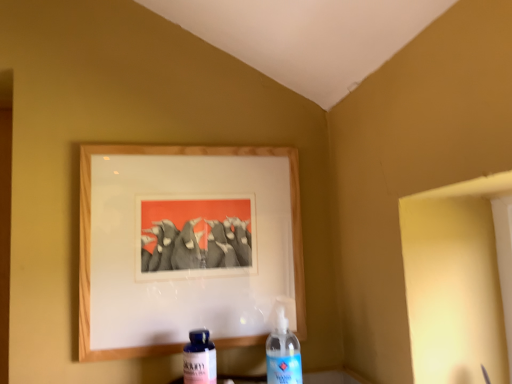
This screenshot has height=384, width=512. Describe the element at coordinates (183, 155) in the screenshot. I see `wooden picture frame at upper center` at that location.

What do you see at coordinates (283, 352) in the screenshot? I see `transparent plastic bottle at center, which is counted as the 1th bottle, starting from the right` at bounding box center [283, 352].

Find the location of `blue glass bottle at lower center, which ranks as the 2th bottle in right-to-left order`. blue glass bottle at lower center, which ranks as the 2th bottle in right-to-left order is located at coordinates (199, 358).

Could you measure the distance between blue glass bottle at lower center, which ranks as the 2th bottle in right-to-left order, and wooden picture frame at upper center?

blue glass bottle at lower center, which ranks as the 2th bottle in right-to-left order, and wooden picture frame at upper center are 24.17 centimeters apart.

Is blue glass bottle at lower center, marked as the first bottle in a left-to-right arrangement, in front of wooden picture frame at upper center?

Yes, it is in front of wooden picture frame at upper center.

From a real-world perspective, is blue glass bottle at lower center, which ranks as the 2th bottle in right-to-left order, positioned above or below wooden picture frame at upper center?

In terms of real-world spatial position, blue glass bottle at lower center, which ranks as the 2th bottle in right-to-left order, is below wooden picture frame at upper center.

Does point (215, 349) come farther from viewer compared to point (226, 345)?

No, (215, 349) is closer to viewer.

In order to click on the 1st bottle directly beneath the wooden picture frame at upper center (from a real-world perspective) in this screenshot , I will do `click(283, 352)`.

Which of these two, transparent plastic bottle at center, which ranks as the 2th bottle in left-to-right order, or wooden picture frame at upper center, is bigger?

With larger size is wooden picture frame at upper center.

From the image's perspective, which object appears higher, transparent plastic bottle at center, which is counted as the 1th bottle, starting from the right, or wooden picture frame at upper center?

wooden picture frame at upper center.

Does transparent plastic bottle at center, which is counted as the 1th bottle, starting from the right, lie behind wooden picture frame at upper center?

No, transparent plastic bottle at center, which is counted as the 1th bottle, starting from the right, is closer to the camera.

From the picture: From the image's perspective, between wooden picture frame at upper center and transparent plastic bottle at center, which is counted as the 1th bottle, starting from the right, who is located below?

From the image's view, transparent plastic bottle at center, which is counted as the 1th bottle, starting from the right, is below.

Considering the relative positions of wooden picture frame at upper center and transparent plastic bottle at center, which ranks as the 2th bottle in left-to-right order, in the image provided, is wooden picture frame at upper center to the left or to the right of transparent plastic bottle at center, which ranks as the 2th bottle in left-to-right order,?

wooden picture frame at upper center is to the left of transparent plastic bottle at center, which ranks as the 2th bottle in left-to-right order.

How different are the orientations of wooden picture frame at upper center and transparent plastic bottle at center, which is counted as the 1th bottle, starting from the right, in degrees?

The angular difference between wooden picture frame at upper center and transparent plastic bottle at center, which is counted as the 1th bottle, starting from the right, is 4.75 degrees.

Is wooden picture frame at upper center outside of transparent plastic bottle at center, which ranks as the 2th bottle in left-to-right order?

Indeed, wooden picture frame at upper center is completely outside transparent plastic bottle at center, which ranks as the 2th bottle in left-to-right order.

From the image's perspective, is blue glass bottle at lower center, marked as the first bottle in a left-to-right arrangement, located above or below transparent plastic bottle at center, which ranks as the 2th bottle in left-to-right order?

Clearly, from the image's perspective, blue glass bottle at lower center, marked as the first bottle in a left-to-right arrangement, is below transparent plastic bottle at center, which ranks as the 2th bottle in left-to-right order.

Is blue glass bottle at lower center, which ranks as the 2th bottle in right-to-left order, turned away from transparent plastic bottle at center, which is counted as the 1th bottle, starting from the right?

blue glass bottle at lower center, which ranks as the 2th bottle in right-to-left order, is not turned away from transparent plastic bottle at center, which is counted as the 1th bottle, starting from the right.

In the image, is blue glass bottle at lower center, marked as the first bottle in a left-to-right arrangement, on the left side or the right side of transparent plastic bottle at center, which is counted as the 1th bottle, starting from the right?

Based on their positions, blue glass bottle at lower center, marked as the first bottle in a left-to-right arrangement, is located to the left of transparent plastic bottle at center, which is counted as the 1th bottle, starting from the right.

Is blue glass bottle at lower center, marked as the first bottle in a left-to-right arrangement, next to transparent plastic bottle at center, which ranks as the 2th bottle in left-to-right order?

blue glass bottle at lower center, marked as the first bottle in a left-to-right arrangement, and transparent plastic bottle at center, which ranks as the 2th bottle in left-to-right order, are clearly separated.

Is point (300, 380) closer or farther from the camera than point (196, 357)?

Point (300, 380) is positioned farther from the camera compared to point (196, 357).

Does transparent plastic bottle at center, which is counted as the 1th bottle, starting from the right, have a smaller size compared to blue glass bottle at lower center, marked as the first bottle in a left-to-right arrangement?

No, transparent plastic bottle at center, which is counted as the 1th bottle, starting from the right, is not smaller than blue glass bottle at lower center, marked as the first bottle in a left-to-right arrangement.

From the image's perspective, which object appears higher, transparent plastic bottle at center, which ranks as the 2th bottle in left-to-right order, or blue glass bottle at lower center, marked as the first bottle in a left-to-right arrangement?

transparent plastic bottle at center, which ranks as the 2th bottle in left-to-right order, appears higher in the image.

From the picture: Is transparent plastic bottle at center, which is counted as the 1th bottle, starting from the right, further to camera compared to blue glass bottle at lower center, marked as the first bottle in a left-to-right arrangement?

No, it is not.

Where is `picture frame that appears above the blue glass bottle at lower center, which ranks as the 2th bottle in right-to-left order (from the image's perspective)`? This screenshot has height=384, width=512. picture frame that appears above the blue glass bottle at lower center, which ranks as the 2th bottle in right-to-left order (from the image's perspective) is located at coordinates (183, 155).

Considering the positions of objects wooden picture frame at upper center and blue glass bottle at lower center, which ranks as the 2th bottle in right-to-left order, in the image provided, who is more to the left, wooden picture frame at upper center or blue glass bottle at lower center, which ranks as the 2th bottle in right-to-left order,?

wooden picture frame at upper center is more to the left.

Which is behind, wooden picture frame at upper center or blue glass bottle at lower center, marked as the first bottle in a left-to-right arrangement?

wooden picture frame at upper center.

From a real-world perspective, starting from the wooden picture frame at upper center, which bottle is the 2nd one below it? Please provide its 2D coordinates.

[(199, 358)]

Image resolution: width=512 pixels, height=384 pixels. I want to click on bottle that is the 2nd one when counting rightward from the wooden picture frame at upper center, so click(283, 352).

Looking at the image, which one is located further to transparent plastic bottle at center, which ranks as the 2th bottle in left-to-right order, blue glass bottle at lower center, marked as the first bottle in a left-to-right arrangement, or wooden picture frame at upper center?

wooden picture frame at upper center is positioned further to the anchor transparent plastic bottle at center, which ranks as the 2th bottle in left-to-right order.

Considering their positions, is wooden picture frame at upper center positioned further to transparent plastic bottle at center, which ranks as the 2th bottle in left-to-right order, than blue glass bottle at lower center, which ranks as the 2th bottle in right-to-left order?

wooden picture frame at upper center is further to transparent plastic bottle at center, which ranks as the 2th bottle in left-to-right order.

Looking at the image, which one is located further to blue glass bottle at lower center, which ranks as the 2th bottle in right-to-left order, wooden picture frame at upper center or transparent plastic bottle at center, which ranks as the 2th bottle in left-to-right order?

wooden picture frame at upper center is positioned further to the anchor blue glass bottle at lower center, which ranks as the 2th bottle in right-to-left order.

From the image, which object appears to be farther from wooden picture frame at upper center, blue glass bottle at lower center, which ranks as the 2th bottle in right-to-left order, or transparent plastic bottle at center, which is counted as the 1th bottle, starting from the right?

Based on the image, blue glass bottle at lower center, which ranks as the 2th bottle in right-to-left order, appears to be further to wooden picture frame at upper center.

Looking at the image, which one is located closer to blue glass bottle at lower center, which ranks as the 2th bottle in right-to-left order, transparent plastic bottle at center, which ranks as the 2th bottle in left-to-right order, or wooden picture frame at upper center?

Among the two, transparent plastic bottle at center, which ranks as the 2th bottle in left-to-right order, is located nearer to blue glass bottle at lower center, which ranks as the 2th bottle in right-to-left order.

Considering their positions, is transparent plastic bottle at center, which ranks as the 2th bottle in left-to-right order, positioned closer to wooden picture frame at upper center than blue glass bottle at lower center, marked as the first bottle in a left-to-right arrangement?

transparent plastic bottle at center, which ranks as the 2th bottle in left-to-right order, lies closer to wooden picture frame at upper center than the other object.

This screenshot has height=384, width=512. Find the location of `bottle between wooden picture frame at upper center and blue glass bottle at lower center, which ranks as the 2th bottle in right-to-left order, in the vertical direction`. bottle between wooden picture frame at upper center and blue glass bottle at lower center, which ranks as the 2th bottle in right-to-left order, in the vertical direction is located at coordinates (283, 352).